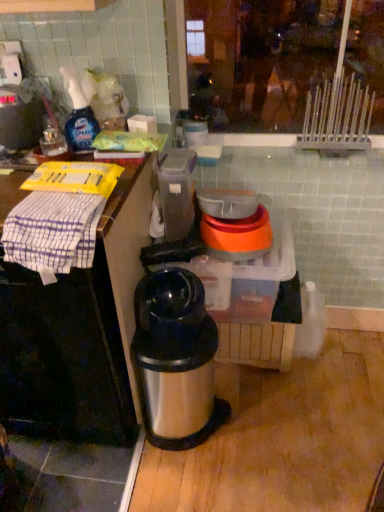
Where is `vacant region above translucent plastic container at center, placed as the 2th appliance when sorted from right to left (from a real-world perspective)`? The image size is (384, 512). vacant region above translucent plastic container at center, placed as the 2th appliance when sorted from right to left (from a real-world perspective) is located at coordinates (171, 152).